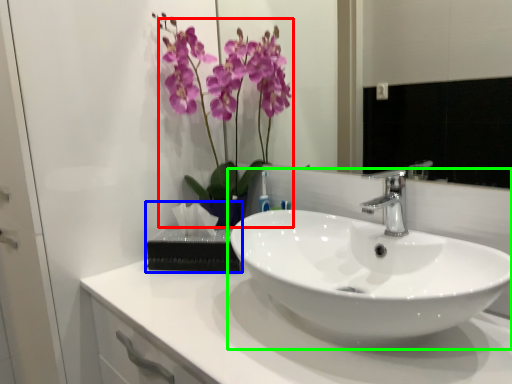
Question: Based on their relative distances, which object is nearer to floral arrangement (highlighted by a red box)? Choose from tissue (highlighted by a blue box) and sink (highlighted by a green box).

Choices:
 (A) tissue
 (B) sink

Answer: (A)